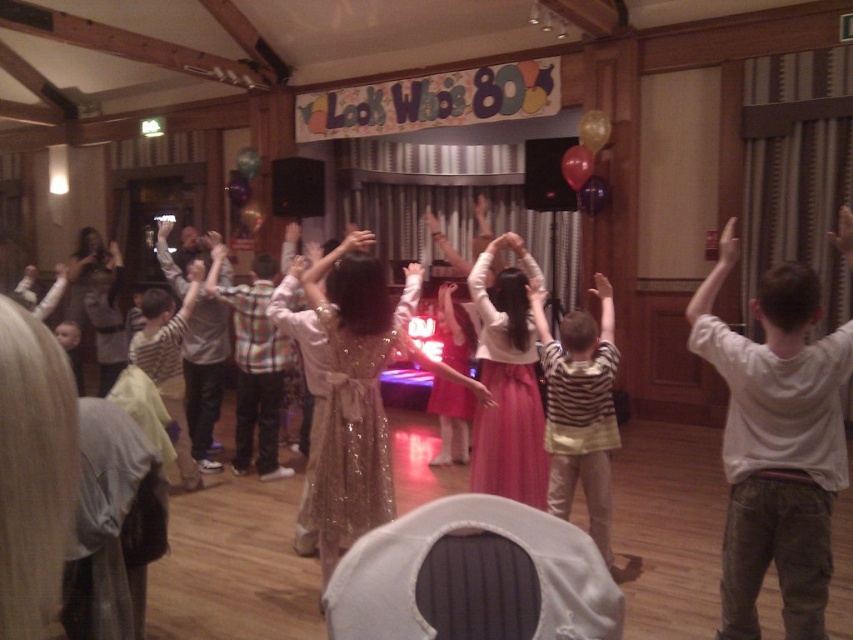
Looking at this image, does translucent pink balloon at upper center have a greater width compared to translucent purple balloon at upper center?

No, translucent pink balloon at upper center is not wider than translucent purple balloon at upper center.

Between translucent pink balloon at upper center and translucent purple balloon at upper center, which one has more height?

translucent pink balloon at upper center

Does point (572, 179) lie behind point (601, 189)?

No, (572, 179) is in front of (601, 189).

At what (x,y) coordinates should I click in order to perform the action: click on translucent pink balloon at upper center. Please return your answer as a coordinate pair (x, y). The image size is (853, 640). Looking at the image, I should click on (577, 164).

Does shiny pink dress at center have a larger size compared to gold metallic balloon at upper center?

Correct, shiny pink dress at center is larger in size than gold metallic balloon at upper center.

Can you confirm if shiny pink dress at center is positioned below gold metallic balloon at upper center?

Correct, shiny pink dress at center is located below gold metallic balloon at upper center.

The image size is (853, 640). What are the coordinates of `shiny pink dress at center` in the screenshot? It's located at (451, 420).

This screenshot has width=853, height=640. Find the location of `shiny pink dress at center`. shiny pink dress at center is located at coordinates (451, 420).

How far apart are white cotton shirt at center and gold metallic balloon at upper center?

They are 3.96 meters apart.

Does white cotton shirt at center appear on the right side of gold metallic balloon at upper center?

Incorrect, white cotton shirt at center is not on the right side of gold metallic balloon at upper center.

Is point (799, 483) farther from camera compared to point (590, 132)?

No, (799, 483) is closer to viewer.

This screenshot has width=853, height=640. Identify the location of white cotton shirt at center. (776, 444).